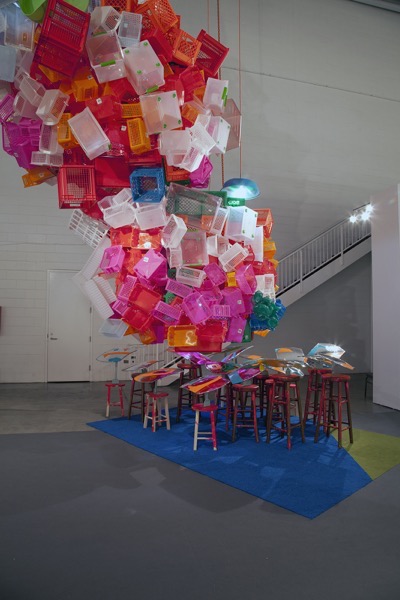
I want to click on white stools with pink/red paint, so click(x=196, y=432), click(x=166, y=412), click(x=122, y=408).